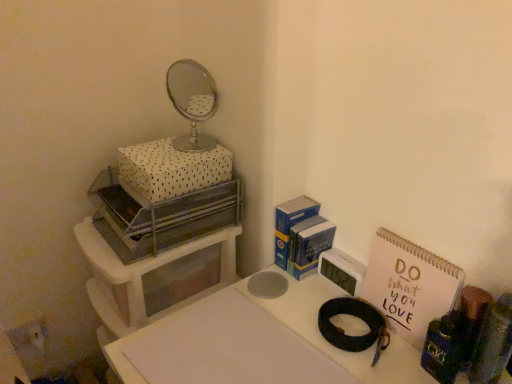
The width and height of the screenshot is (512, 384). Identify the location of vacant area situated to the left side of white plastic clock at center-right, which is the third appliance from front to back. (284, 297).